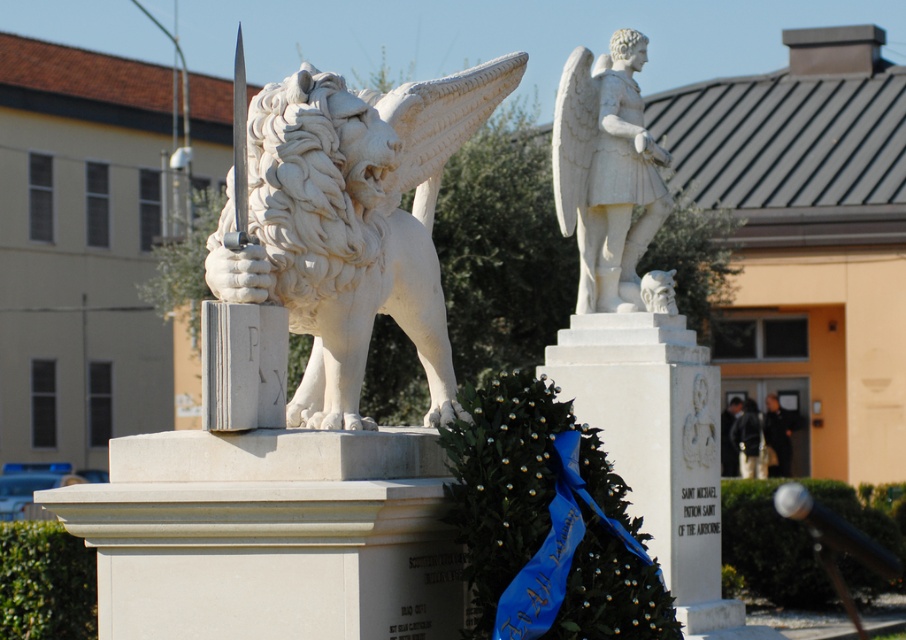
Question: Which point is farther to the camera?

Choices:
 (A) (569, 352)
 (B) (601, 168)
 (C) (423, 296)

Answer: (B)

Question: Can you confirm if white marble pillar at center is smaller than white marble angel at upper right?

Choices:
 (A) no
 (B) yes

Answer: (B)

Question: Is white marble lion at center to the right of white marble angel at upper right from the viewer's perspective?

Choices:
 (A) yes
 (B) no

Answer: (B)

Question: Based on their relative distances, which object is nearer to the white marble pillar at center?

Choices:
 (A) white marble lion at center
 (B) white marble angel at upper right

Answer: (B)

Question: Is white marble pillar at center bigger than white marble angel at upper right?

Choices:
 (A) no
 (B) yes

Answer: (A)

Question: Based on their relative distances, which object is nearer to the white marble angel at upper right?

Choices:
 (A) white marble lion at center
 (B) white marble pillar at center

Answer: (B)